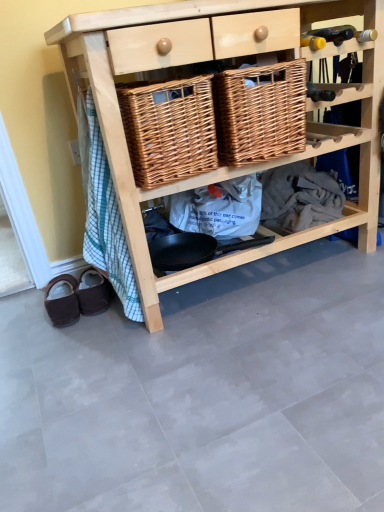
Image resolution: width=384 pixels, height=512 pixels. I want to click on vacant space in front of natural wood shelf at center, so click(x=246, y=373).